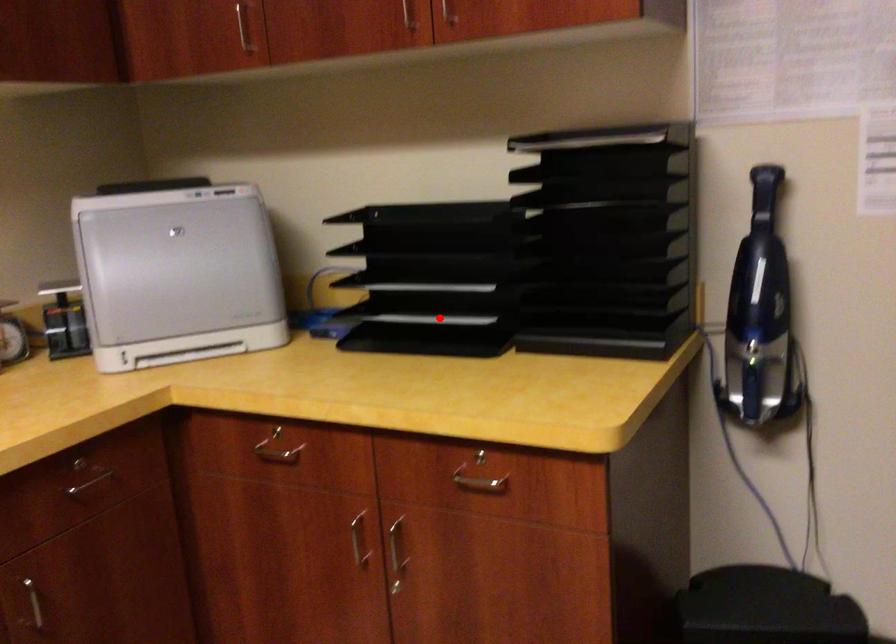
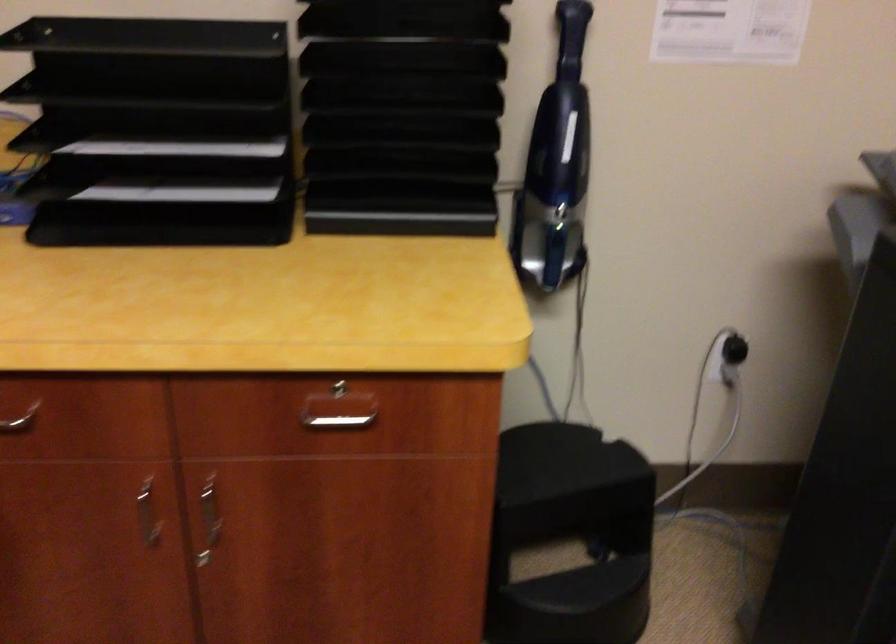
Question: A red point is marked in image1. In image2, is the corresponding 3D point closer to the camera or farther? Reply with the corresponding letter.

Choices:
 (A) The corresponding 3D point is closer.
 (B) The corresponding 3D point is farther.

Answer: (A)